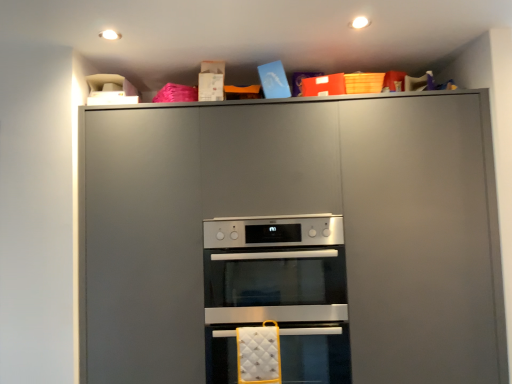
What is the approximate height of silver metallic oven at center, the second oven viewed from the top?

silver metallic oven at center, the second oven viewed from the top, is 17.90 inches tall.

Find the location of `matte gray cabinet at upper center`. matte gray cabinet at upper center is located at coordinates (293, 239).

Who is taller, matte gray cabinet at upper center or silver metallic oven at center, which is the first oven from bottom to top?

matte gray cabinet at upper center.

Is matte gray cabinet at upper center far away from silver metallic oven at center, the second oven viewed from the top?

No, there isn't a large distance between matte gray cabinet at upper center and silver metallic oven at center, the second oven viewed from the top.

Is matte gray cabinet at upper center wider than silver metallic oven at center, which is the first oven from bottom to top?

In fact, matte gray cabinet at upper center might be narrower than silver metallic oven at center, which is the first oven from bottom to top.

Considering the positions of objects matte gray cabinet at upper center and silver metallic oven at center, which is the first oven from bottom to top, in the image provided, who is behind, matte gray cabinet at upper center or silver metallic oven at center, which is the first oven from bottom to top,?

silver metallic oven at center, which is the first oven from bottom to top, is further from the camera.

Which of these two, satin silver oven at center, positioned as the first oven in top-to-bottom order, or silver metallic oven at center, the second oven viewed from the top, stands shorter?

satin silver oven at center, positioned as the first oven in top-to-bottom order, is shorter.

How different are the orientations of satin silver oven at center, placed as the 2th oven when sorted from bottom to top, and silver metallic oven at center, which is the first oven from bottom to top, in degrees?

8.67e-05 degrees.

Could you tell me if satin silver oven at center, positioned as the first oven in top-to-bottom order, is turned towards silver metallic oven at center, the second oven viewed from the top?

No, satin silver oven at center, positioned as the first oven in top-to-bottom order, does not turn towards silver metallic oven at center, the second oven viewed from the top.

From a real-world perspective, between satin silver oven at center, positioned as the first oven in top-to-bottom order, and silver metallic oven at center, which is the first oven from bottom to top, who is vertically higher?

In real-world perspective, satin silver oven at center, positioned as the first oven in top-to-bottom order, is above.

Find the location of a particular element. The height and width of the screenshot is (384, 512). the 2nd oven behind the matte gray cabinet at upper center, counting from the anchor's position is located at coordinates (278, 293).

Is satin silver oven at center, placed as the 2th oven when sorted from bottom to top, taller than matte gray cabinet at upper center?

Incorrect, the height of satin silver oven at center, placed as the 2th oven when sorted from bottom to top, is not larger of that of matte gray cabinet at upper center.

Is satin silver oven at center, positioned as the first oven in top-to-bottom order, oriented towards matte gray cabinet at upper center?

Yes, satin silver oven at center, positioned as the first oven in top-to-bottom order, is turned towards matte gray cabinet at upper center.

Considering the sizes of objects satin silver oven at center, positioned as the first oven in top-to-bottom order, and matte gray cabinet at upper center in the image provided, who is wider, satin silver oven at center, positioned as the first oven in top-to-bottom order, or matte gray cabinet at upper center?

With larger width is satin silver oven at center, positioned as the first oven in top-to-bottom order.

From the image's perspective, which is below, matte gray cabinet at upper center or satin silver oven at center, placed as the 2th oven when sorted from bottom to top?

satin silver oven at center, placed as the 2th oven when sorted from bottom to top, is shown below in the image.

Which is closer, (362, 119) or (281, 346)?

The point (362, 119) is more forward.

Who is taller, matte gray cabinet at upper center or satin silver oven at center, placed as the 2th oven when sorted from bottom to top?

With more height is matte gray cabinet at upper center.

Does matte gray cabinet at upper center come in front of satin silver oven at center, positioned as the first oven in top-to-bottom order?

Yes, it is.

Is silver metallic oven at center, which is the first oven from bottom to top, smaller than satin silver oven at center, positioned as the first oven in top-to-bottom order?

No.

Between point (314, 361) and point (294, 323), which one is positioned behind?

The point (314, 361) is behind.

Does silver metallic oven at center, which is the first oven from bottom to top, have a lesser height compared to satin silver oven at center, positioned as the first oven in top-to-bottom order?

No.

Considering the relative positions of silver metallic oven at center, which is the first oven from bottom to top, and satin silver oven at center, positioned as the first oven in top-to-bottom order, in the image provided, is silver metallic oven at center, which is the first oven from bottom to top, behind satin silver oven at center, positioned as the first oven in top-to-bottom order,?

No, it is in front of satin silver oven at center, positioned as the first oven in top-to-bottom order.

In the image, is silver metallic oven at center, the second oven viewed from the top, positioned in front of or behind matte gray cabinet at upper center?

In the image, silver metallic oven at center, the second oven viewed from the top, appears behind matte gray cabinet at upper center.

Can you confirm if silver metallic oven at center, which is the first oven from bottom to top, is taller than matte gray cabinet at upper center?

In fact, silver metallic oven at center, which is the first oven from bottom to top, may be shorter than matte gray cabinet at upper center.

Could you tell me if silver metallic oven at center, the second oven viewed from the top, is facing matte gray cabinet at upper center?

Yes, silver metallic oven at center, the second oven viewed from the top, faces towards matte gray cabinet at upper center.

Locate an element on the screen. Image resolution: width=512 pixels, height=384 pixels. the 1st oven counting from the left side of the matte gray cabinet at upper center is located at coordinates (315, 353).

Find the location of a particular element. This screenshot has width=512, height=384. the 1st oven counting from the left of the matte gray cabinet at upper center is located at coordinates (315, 353).

In order to click on oven that is below the satin silver oven at center, positioned as the first oven in top-to-bottom order (from the image's perspective) in this screenshot , I will do `click(315, 353)`.

Based on their spatial positions, is matte gray cabinet at upper center or silver metallic oven at center, which is the first oven from bottom to top, closer to satin silver oven at center, positioned as the first oven in top-to-bottom order?

Based on the image, silver metallic oven at center, which is the first oven from bottom to top, appears to be nearer to satin silver oven at center, positioned as the first oven in top-to-bottom order.

Based on their spatial positions, is silver metallic oven at center, which is the first oven from bottom to top, or satin silver oven at center, placed as the 2th oven when sorted from bottom to top, closer to matte gray cabinet at upper center?

The object closer to matte gray cabinet at upper center is satin silver oven at center, placed as the 2th oven when sorted from bottom to top.

Based on the photo, considering their positions, is silver metallic oven at center, the second oven viewed from the top, positioned closer to satin silver oven at center, positioned as the first oven in top-to-bottom order, than matte gray cabinet at upper center?

Among the two, silver metallic oven at center, the second oven viewed from the top, is located nearer to satin silver oven at center, positioned as the first oven in top-to-bottom order.

Looking at the image, which one is located further to silver metallic oven at center, which is the first oven from bottom to top, satin silver oven at center, placed as the 2th oven when sorted from bottom to top, or matte gray cabinet at upper center?

matte gray cabinet at upper center is positioned further to the anchor silver metallic oven at center, which is the first oven from bottom to top.

From the image, which object appears to be nearer to silver metallic oven at center, the second oven viewed from the top, matte gray cabinet at upper center or satin silver oven at center, positioned as the first oven in top-to-bottom order?

The object closer to silver metallic oven at center, the second oven viewed from the top, is satin silver oven at center, positioned as the first oven in top-to-bottom order.

Which object lies nearer to the anchor point matte gray cabinet at upper center, satin silver oven at center, positioned as the first oven in top-to-bottom order, or silver metallic oven at center, which is the first oven from bottom to top?

Based on the image, satin silver oven at center, positioned as the first oven in top-to-bottom order, appears to be nearer to matte gray cabinet at upper center.

At what (x,y) coordinates should I click in order to perform the action: click on oven that lies between matte gray cabinet at upper center and silver metallic oven at center, which is the first oven from bottom to top, from top to bottom. Please return your answer as a coordinate pair (x, y). This screenshot has height=384, width=512. Looking at the image, I should click on (278, 293).